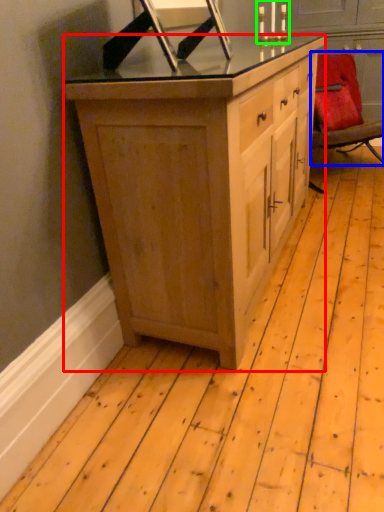
Question: Which is farther away from cabinetry (highlighted by a red box)? chair (highlighted by a blue box) or candle holder (highlighted by a green box)?

Choices:
 (A) chair
 (B) candle holder

Answer: (B)